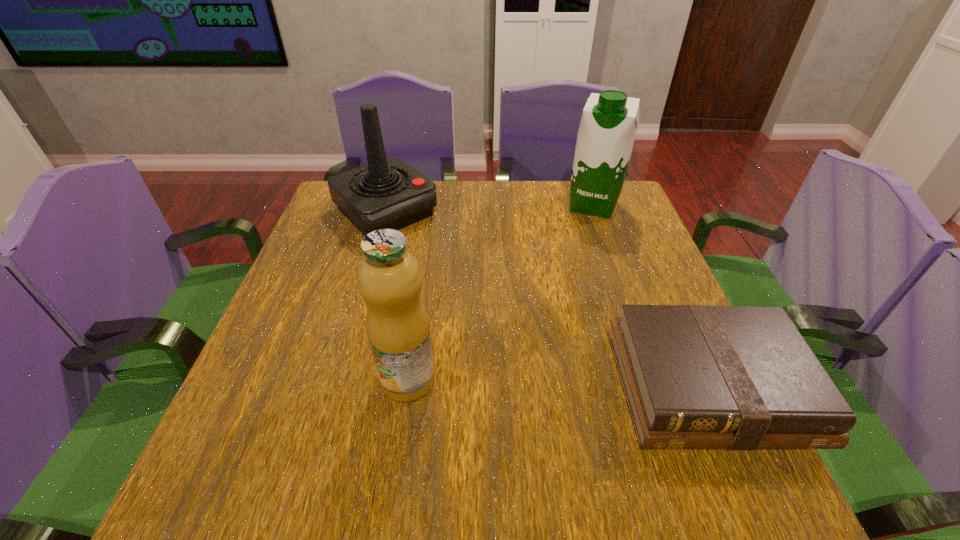
This screenshot has height=540, width=960. Find the location of `fruit juice`. fruit juice is located at coordinates (389, 279).

This screenshot has width=960, height=540. Identify the location of the shortest object. (694, 376).

The width and height of the screenshot is (960, 540). What are the coordinates of `soya milk` in the screenshot? It's located at (606, 135).

The width and height of the screenshot is (960, 540). I want to click on joystick, so click(x=387, y=193).

Locate an element on the screen. free space located on the front label of the fruit juice is located at coordinates (398, 446).

The height and width of the screenshot is (540, 960). Identify the location of vacant position located on the front-facing side of the soya milk. (574, 268).

This screenshot has height=540, width=960. I want to click on vacant space located 0.270m on the front-facing side of the soya milk, so click(x=569, y=281).

The width and height of the screenshot is (960, 540). I want to click on vacant region located on the front-facing side of the soya milk, so click(584, 236).

Identify the location of vacant point located on the front-facing side of the joystick. This screenshot has width=960, height=540. (502, 314).

Where is `vacant space situated on the front-facing side of the joystick`? vacant space situated on the front-facing side of the joystick is located at coordinates (448, 267).